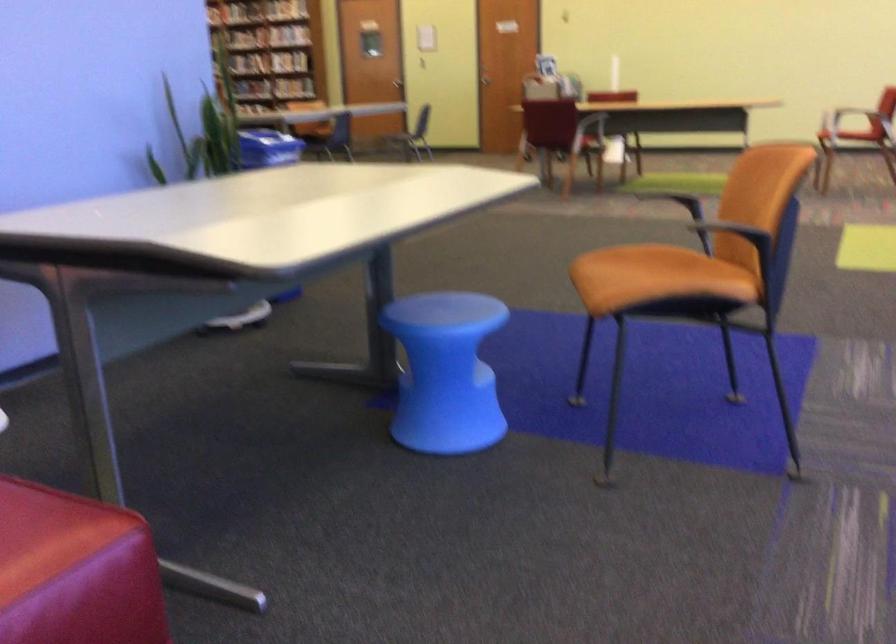
This screenshot has width=896, height=644. In order to click on orange chair sitting surface in this screenshot , I will do `click(682, 270)`.